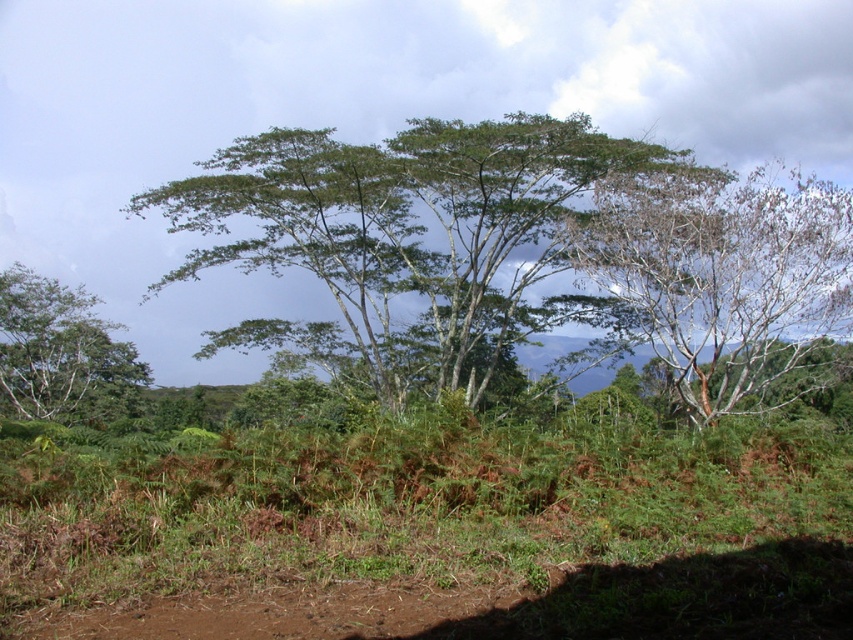
Who is higher up, bare branches tree at right or green leafy tree at left?

Positioned higher is bare branches tree at right.

Can you confirm if bare branches tree at right is bigger than green leafy tree at left?

Correct, bare branches tree at right is larger in size than green leafy tree at left.

Measure the distance between point (850,221) and camera.

Point (850,221) is 15.24 meters away from camera.

You are a GUI agent. You are given a task and a screenshot of the screen. Output one action in this format:
    pyautogui.click(x=<x>, y=<y>)
    Task: Click on the bare branches tree at right
    
    Given the screenshot: What is the action you would take?
    pyautogui.click(x=724, y=280)

Locate an element on the screen. green leafy tree at center is located at coordinates (418, 227).

In the scene shown: Between green leafy tree at center and bare branches tree at right, which one appears on the left side from the viewer's perspective?

green leafy tree at center

Is point (253, 147) in front of point (757, 388)?

No, (253, 147) is behind (757, 388).

The image size is (853, 640). I want to click on green leafy tree at center, so click(x=418, y=227).

Is green leafy tree at center further to the viewer compared to green leafy tree at left?

No, green leafy tree at center is in front of green leafy tree at left.

Is point (379, 156) behind point (122, 396)?

No.

Where is `green leafy tree at center`? green leafy tree at center is located at coordinates (418, 227).

Locate an element on the screen. This screenshot has height=640, width=853. green leafy tree at center is located at coordinates (418, 227).